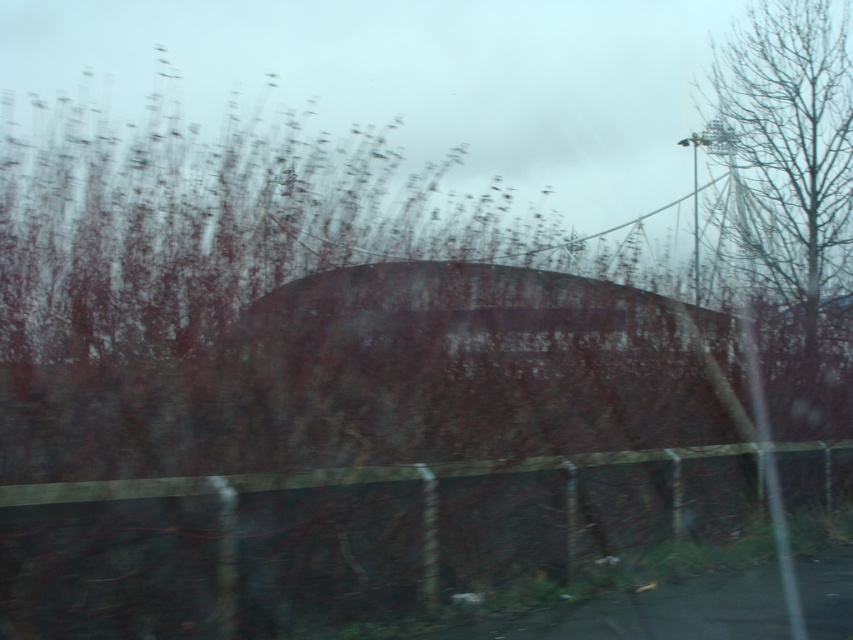
You are driving and notice a wooden fence at center in your rearview mirror. Based on its position, can you estimate how far it is from the vehicle?

The wooden fence at center is located at point (339, 538), which suggests it is relatively close to the vehicle, likely within a short distance from the rear of the car.

You are a photographer trying to capture a landscape photo through the vehicle window. The wooden fence at center and the bare branches at upper right are both in your view. Which object appears smaller in your photo?

The wooden fence at center appears smaller in the photo because it has a smaller size compared to the bare branches at upper right.

You are a passenger in a moving car and notice the wooden fence at center and the bare branches at upper right outside the window. Based on their positions, which object would you say is closer to the car?

The wooden fence at center is closer to the car because it is located below the bare branches at upper right, indicating it is in a lower and nearer position relative to the car.